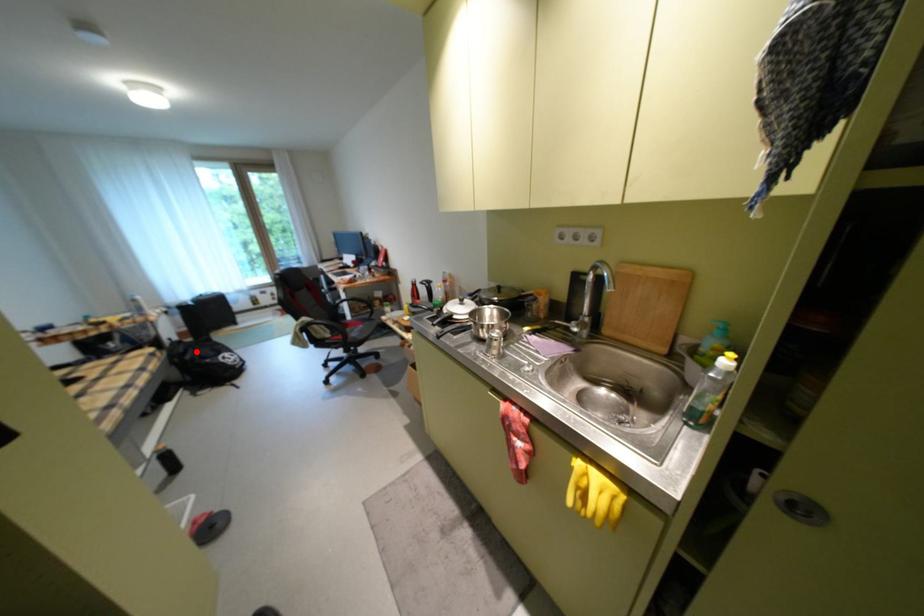
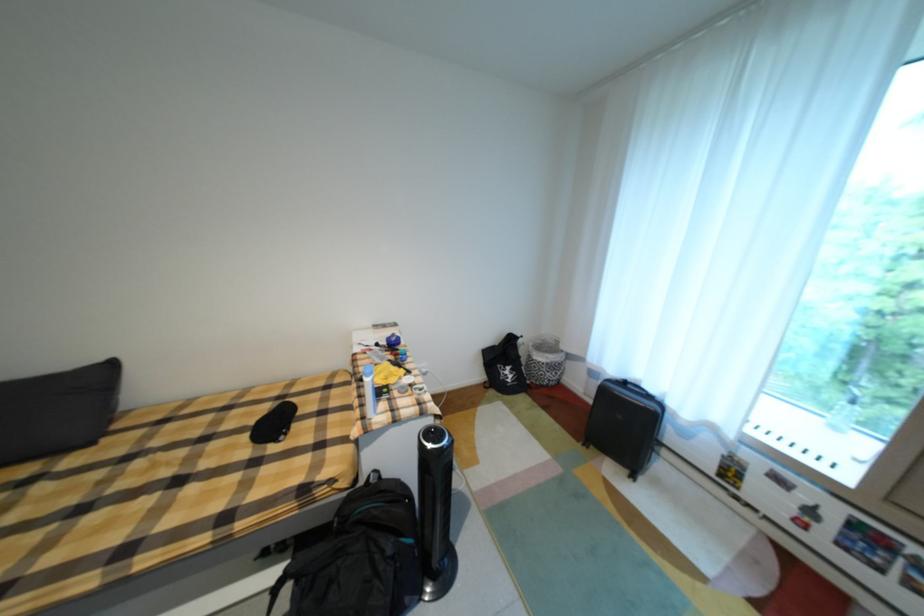
In the second image, find the point that corresponds to the highlighted location in the first image.

(370, 525)